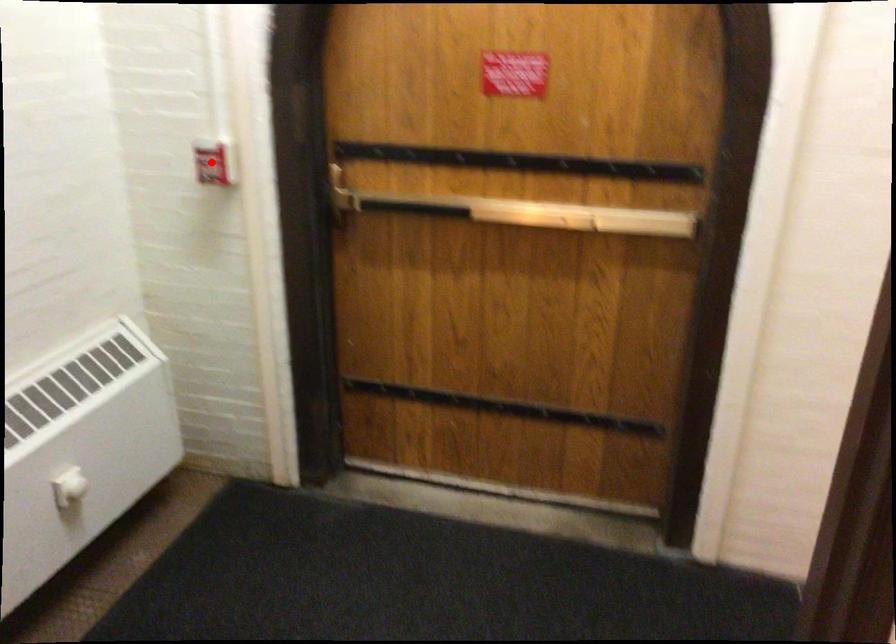
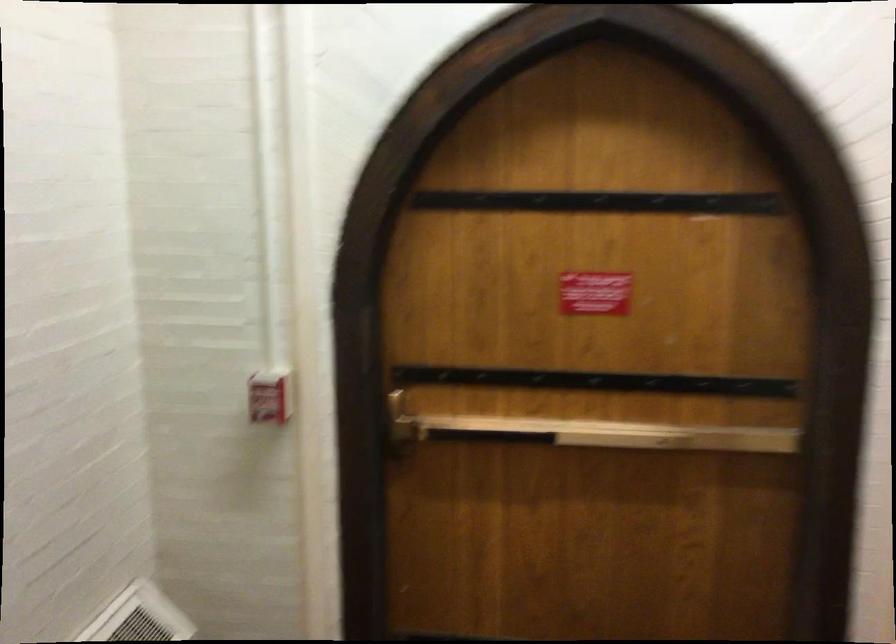
Question: I am providing you with two images of the same scene from different viewpoints. Image1 has a red point marked. In image2, the corresponding 3D location appears at what relative position? Reply with the corresponding letter.

Choices:
 (A) Closer
 (B) Farther

Answer: (A)